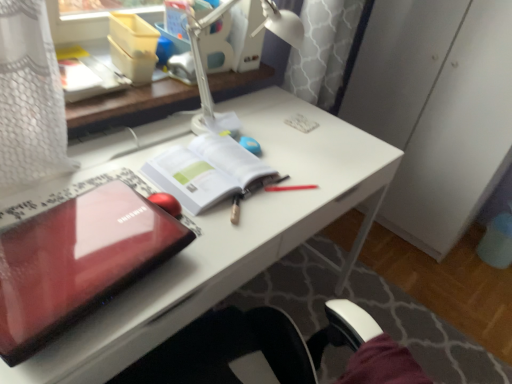
This screenshot has width=512, height=384. Find the location of `unoccupied region to the right of white plastic lamp at upper center`. unoccupied region to the right of white plastic lamp at upper center is located at coordinates (308, 147).